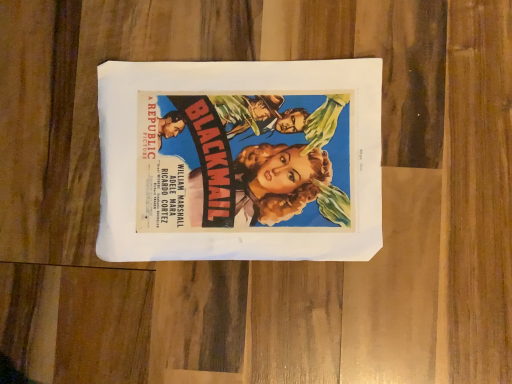
This screenshot has width=512, height=384. In order to click on vacant space situated above matte paper poster at center (from a real-world perspective) in this screenshot , I will do `click(238, 154)`.